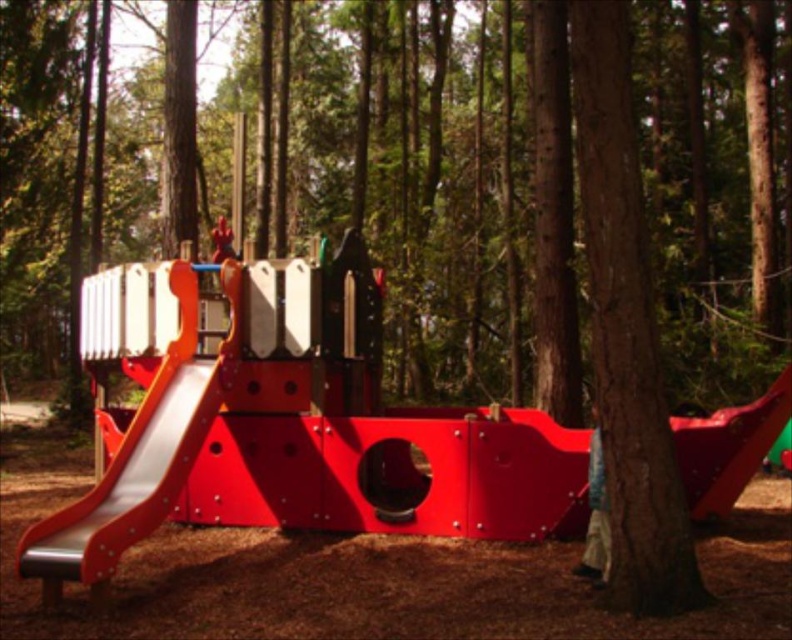
Does point (596, 449) lie in front of point (219, 259)?

Yes.

Between point (591, 576) and point (219, 253), which one is positioned behind?

Positioned behind is point (219, 253).

Locate an element on the screen. This screenshot has height=640, width=792. denim pants at lower right is located at coordinates (596, 513).

Who is positioned more to the left, metallic smooth slide at left or red plastic child at center?

red plastic child at center

Where is `metallic smooth slide at left`? This screenshot has height=640, width=792. metallic smooth slide at left is located at coordinates (130, 480).

Looking at this image, can you confirm if metallic smooth slide at left is bigger than denim pants at lower right?

Indeed, metallic smooth slide at left has a larger size compared to denim pants at lower right.

Who is positioned more to the left, metallic smooth slide at left or denim pants at lower right?

Positioned to the left is metallic smooth slide at left.

This screenshot has height=640, width=792. In order to click on metallic smooth slide at left in this screenshot , I will do `click(130, 480)`.

Find the location of a particular element. metallic smooth slide at left is located at coordinates (130, 480).